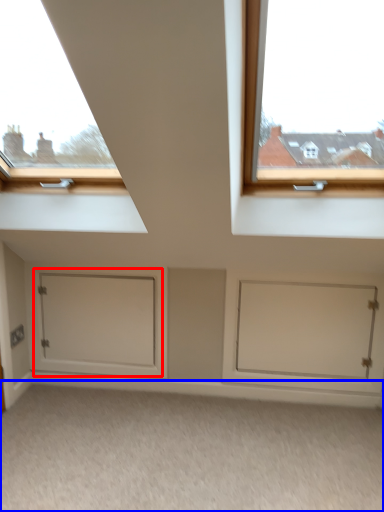
Question: Which object is closer to the camera taking this photo, door (highlighted by a red box) or plain (highlighted by a blue box)?

Choices:
 (A) door
 (B) plain

Answer: (B)